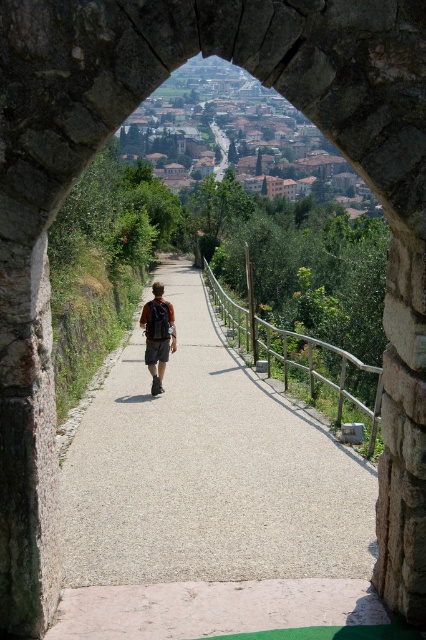
Question: Is the position of light gray gravel path at center less distant than that of matte black backpack at center?

Choices:
 (A) no
 (B) yes

Answer: (B)

Question: Considering the relative positions of light gray gravel path at center and brown backpack at center in the image provided, where is light gray gravel path at center located with respect to brown backpack at center?

Choices:
 (A) left
 (B) right

Answer: (B)

Question: Which object appears closest to the camera in this image?

Choices:
 (A) matte black backpack at center
 (B) light gray gravel path at center

Answer: (B)

Question: Estimate the real-world distances between objects in this image. Which object is farther from the matte black backpack at center?

Choices:
 (A) light gray gravel path at center
 (B) brown backpack at center

Answer: (A)

Question: Estimate the real-world distances between objects in this image. Which object is closer to the brown backpack at center?

Choices:
 (A) matte black backpack at center
 (B) light gray gravel path at center

Answer: (A)

Question: Is light gray gravel path at center closer to the viewer compared to brown backpack at center?

Choices:
 (A) no
 (B) yes

Answer: (B)